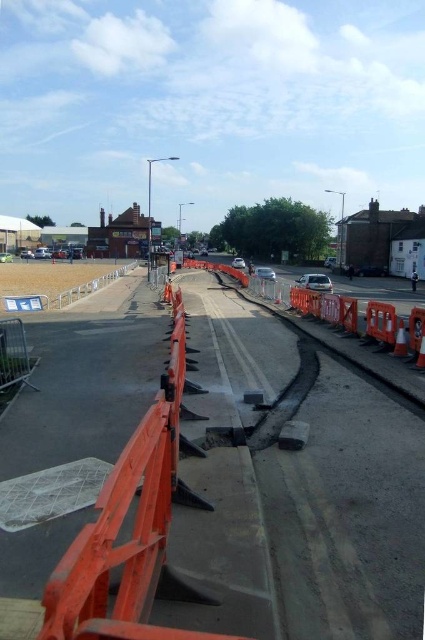
Question: Observing the image, what is the correct spatial positioning of orange plastic barrier at center in reference to orange plastic traffic cone at right?

Choices:
 (A) left
 (B) right

Answer: (A)

Question: Does orange plastic barrier at center appear under orange plastic traffic cone at right?

Choices:
 (A) yes
 (B) no

Answer: (A)

Question: Can you confirm if orange plastic barrier at center is positioned below orange plastic traffic cone at right?

Choices:
 (A) yes
 (B) no

Answer: (A)

Question: Which point is farther from the camera taking this photo?

Choices:
 (A) (402, 339)
 (B) (288, 522)

Answer: (A)